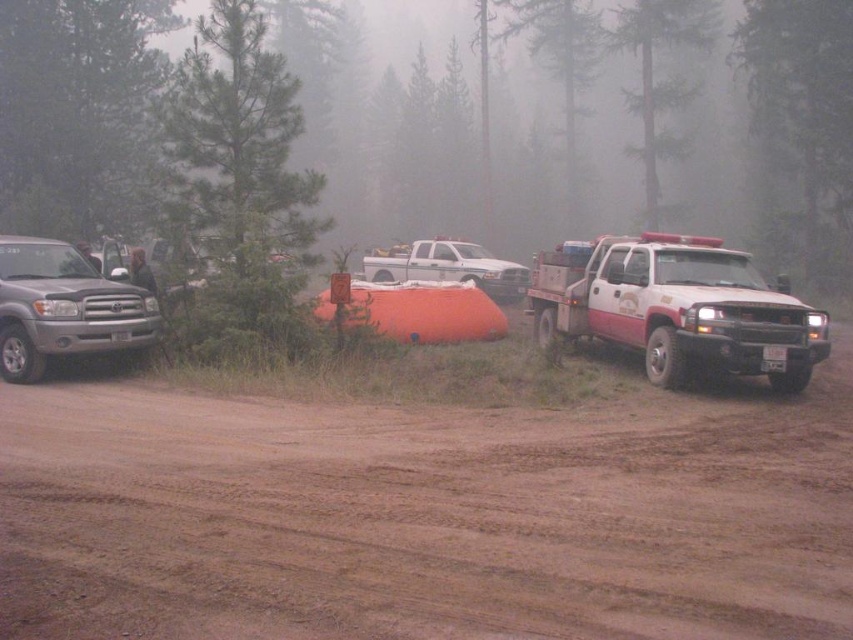
Consider the image. You are a hiker planning to set up a tent in the area. Given the presence of the green textured pine forest at center and the white matte truck at center, which object would provide better protection from the wind? Please explain your reasoning based on their sizes.

The green textured pine forest at center is much taller than the white matte truck at center, so it would provide better protection from the wind due to its greater height and density of trees.